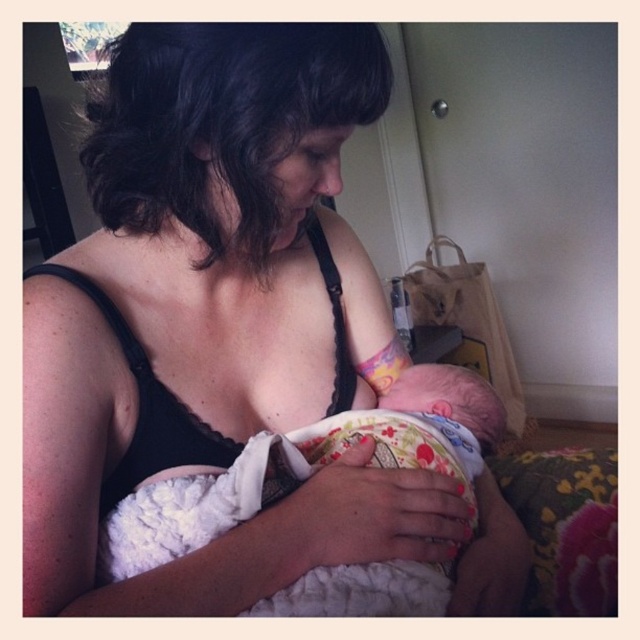
Question: Can you confirm if black lace tank top at center is bigger than fluffy white blanket at center?

Choices:
 (A) no
 (B) yes

Answer: (B)

Question: Among these points, which one is farthest from the camera?

Choices:
 (A) (204, 241)
 (B) (250, 444)

Answer: (A)

Question: Is black lace tank top at center behind fluffy white blanket at center?

Choices:
 (A) yes
 (B) no

Answer: (B)

Question: Is black lace tank top at center to the right of fluffy white blanket at center from the viewer's perspective?

Choices:
 (A) yes
 (B) no

Answer: (B)

Question: Which object is closer to the camera taking this photo?

Choices:
 (A) fluffy white blanket at center
 (B) black lace tank top at center

Answer: (B)